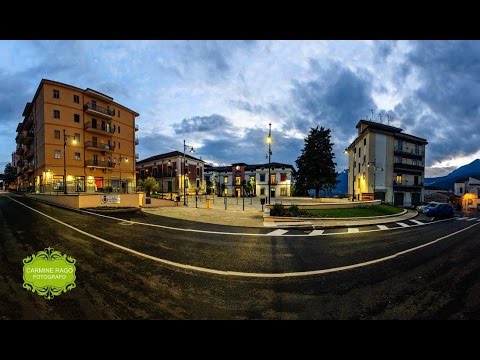
Locate an element on the screen. windows is located at coordinates (54, 110), (58, 94), (74, 97), (75, 114).